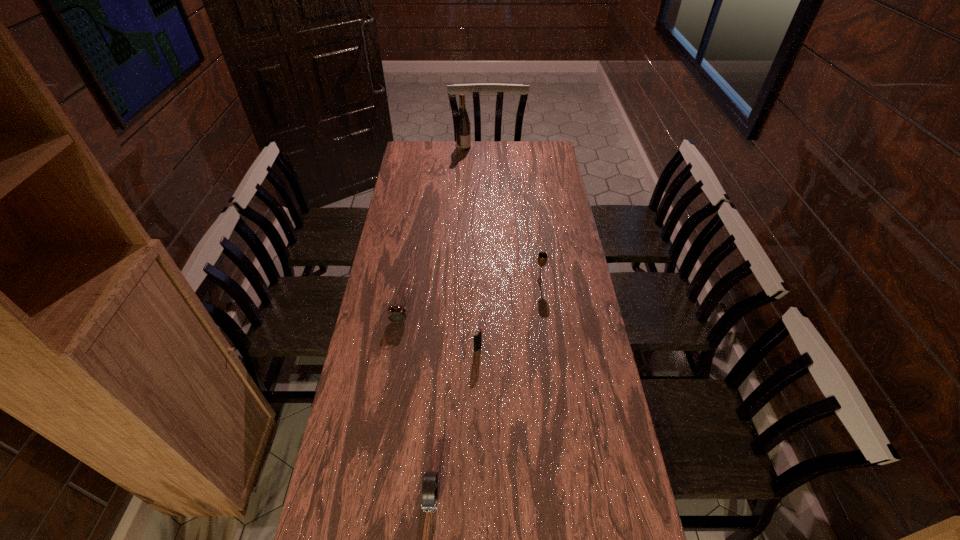
Find the location of a particular element. The height and width of the screenshot is (540, 960). wine bottle is located at coordinates (463, 132).

Identify the location of the tallest object. This screenshot has height=540, width=960. (463, 132).

This screenshot has width=960, height=540. In order to click on chalice in this screenshot , I will do click(x=542, y=258).

Identify the location of the rightmost object. (542, 258).

This screenshot has width=960, height=540. Find the location of `igniter`. igniter is located at coordinates (477, 333).

Image resolution: width=960 pixels, height=540 pixels. I want to click on the fourth farthest object, so click(x=477, y=333).

Image resolution: width=960 pixels, height=540 pixels. Identify the location of the leftmost object. (396, 314).

Where is `the third nearest object`? This screenshot has height=540, width=960. the third nearest object is located at coordinates (396, 314).

Find the location of a particular element. watch is located at coordinates (429, 494).

Where is `vacant space located 0.060m on the right of the farthest object`? The image size is (960, 540). vacant space located 0.060m on the right of the farthest object is located at coordinates (482, 147).